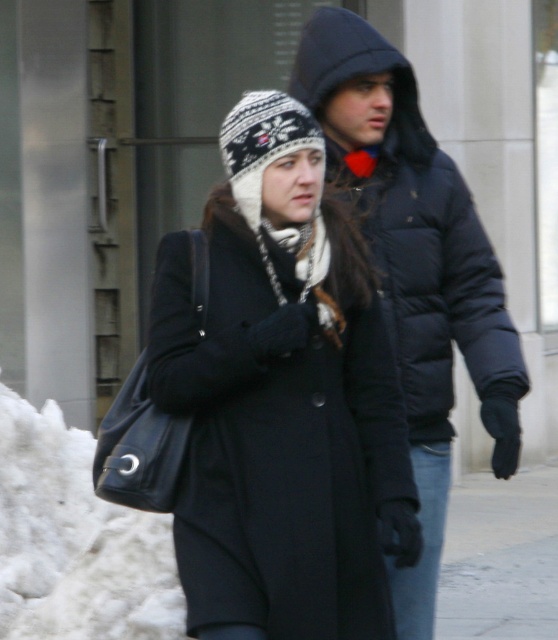
Question: Can you confirm if matte black coat at center is thinner than matte black puffer jacket at center?

Choices:
 (A) no
 (B) yes

Answer: (A)

Question: Which object is positioned farthest from the white knitted scarf at center?

Choices:
 (A) matte black coat at center
 (B) matte black puffer jacket at center

Answer: (B)

Question: Which point appears closest to the camera in this image?

Choices:
 (A) pos(310,268)
 (B) pos(513,413)
 (C) pos(292,349)

Answer: (C)

Question: Is matte black coat at center wider than matte black puffer jacket at center?

Choices:
 (A) no
 (B) yes

Answer: (B)

Question: Is matte black coat at center to the left of matte black puffer jacket at center from the viewer's perspective?

Choices:
 (A) no
 (B) yes

Answer: (B)

Question: Which of the following is the farthest from the observer?

Choices:
 (A) click(309, 74)
 (B) click(198, 349)
 (C) click(288, 237)

Answer: (A)